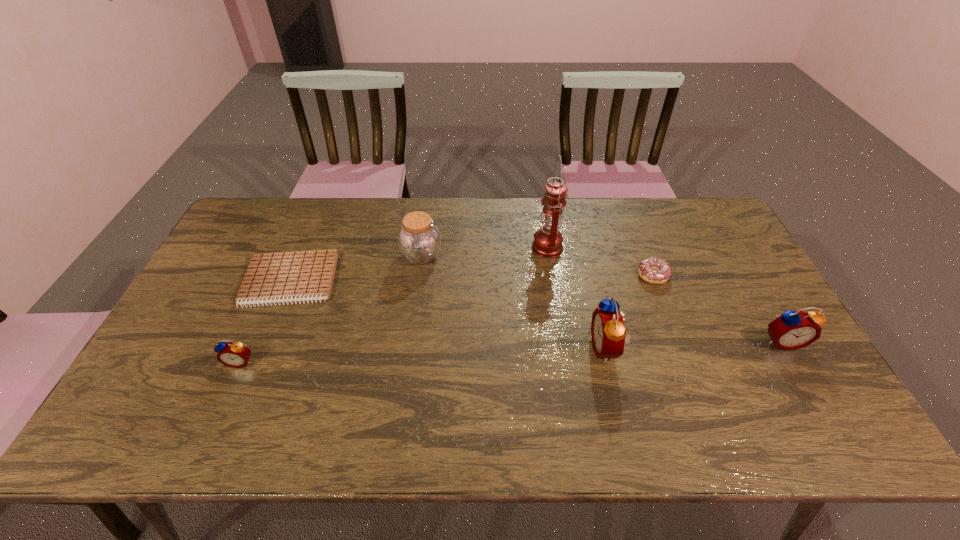
Identify which alarm clock is the closest to the rightmost alarm clock. Please provide its 2D coordinates. Your answer should be formatted as a tuple, i.e. [(x, y)], where the tuple contains the x and y coordinates of a point satisfying the conditions above.

[(608, 331)]

Locate an element on the screen. The image size is (960, 540). alarm clock that is the third closest to the fourth object from left to right is located at coordinates (232, 354).

This screenshot has width=960, height=540. I want to click on vacant position in the image that satisfies the following two spatial constraints: 1. on the back side of the jar; 2. on the left side of the tallest object, so click(422, 247).

Locate an element on the screen. This screenshot has width=960, height=540. vacant area in the image that satisfies the following two spatial constraints: 1. on the front-facing side of the third object from right to left; 2. on the front-facing side of the leftmost alarm clock is located at coordinates (610, 361).

Where is `free space that satisfies the following two spatial constraints: 1. on the front-facing side of the rightmost object; 2. on the front-facing side of the third object from right to left`? This screenshot has height=540, width=960. free space that satisfies the following two spatial constraints: 1. on the front-facing side of the rightmost object; 2. on the front-facing side of the third object from right to left is located at coordinates (785, 348).